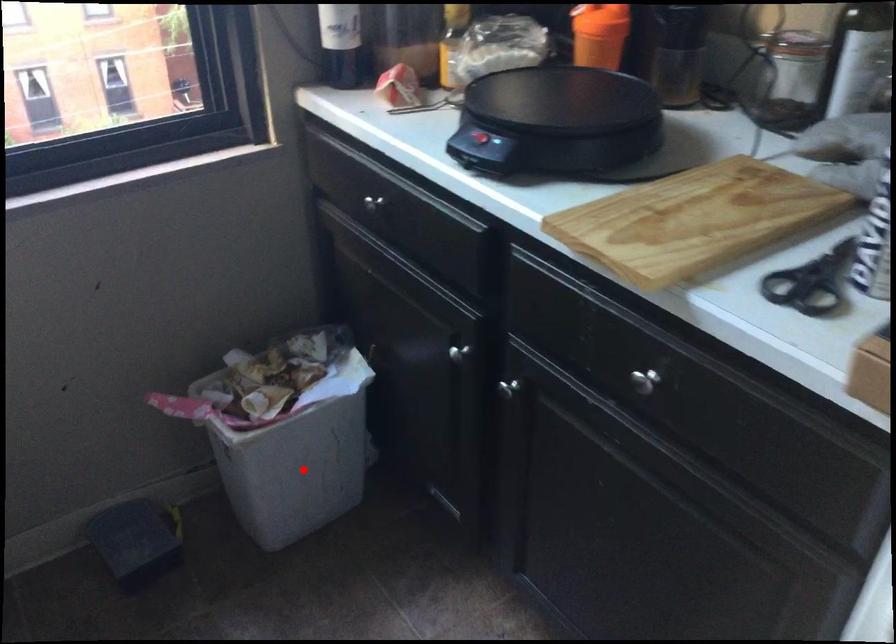
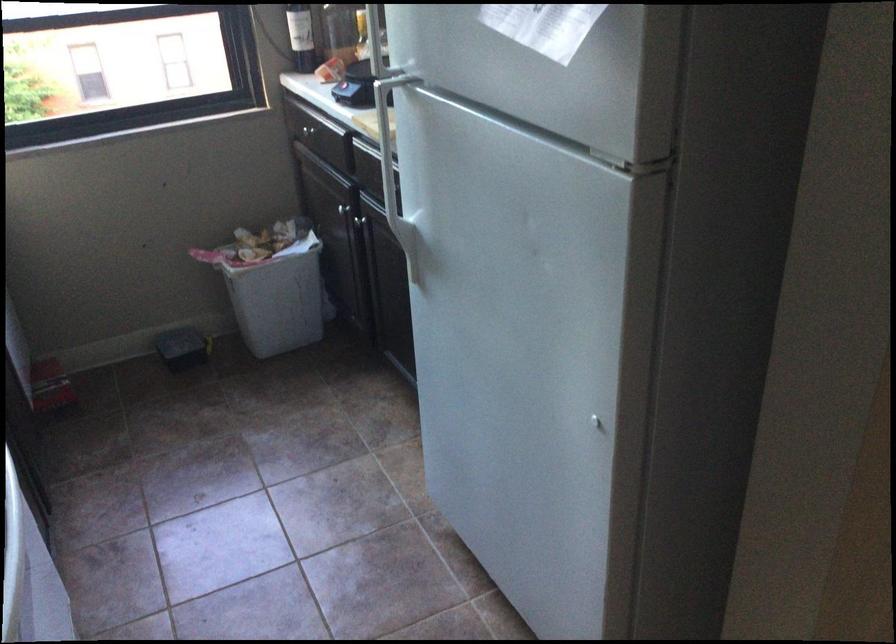
Question: I am providing you with two images of the same scene from different viewpoints. In image1, a red point is highlighted. Considering the same 3D point in image2, which of the following is correct?

Choices:
 (A) It is closer
 (B) It is farther

Answer: (B)